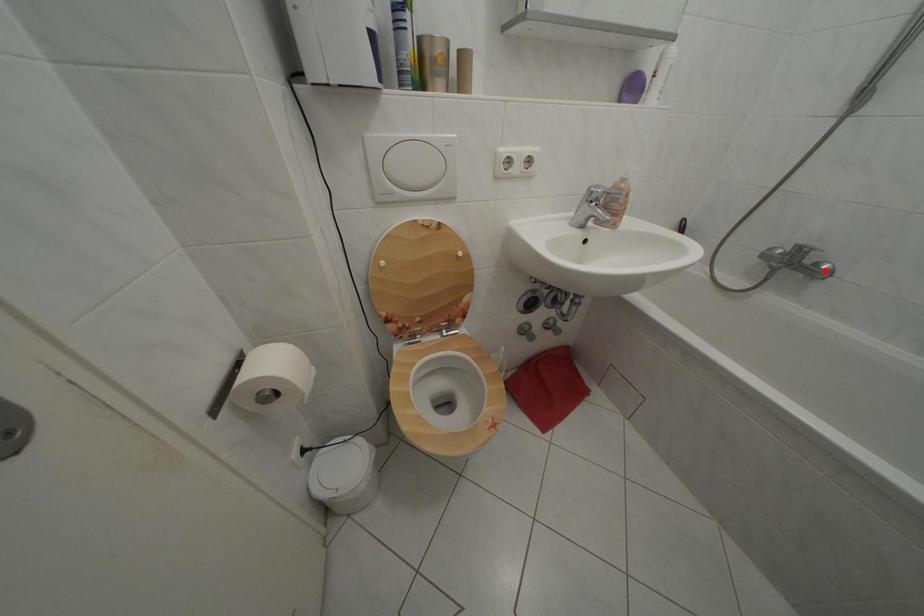
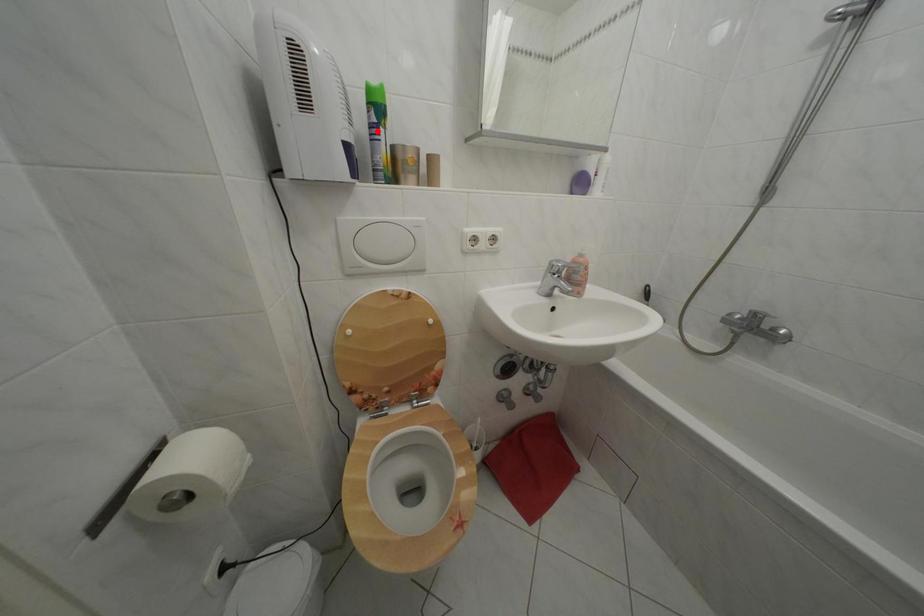
I am providing you with two images of the same scene from different viewpoints. A red point is marked on the first image and another point is marked on the second image. Is the marked point in image1 the same physical position as the marked point in image2?

No